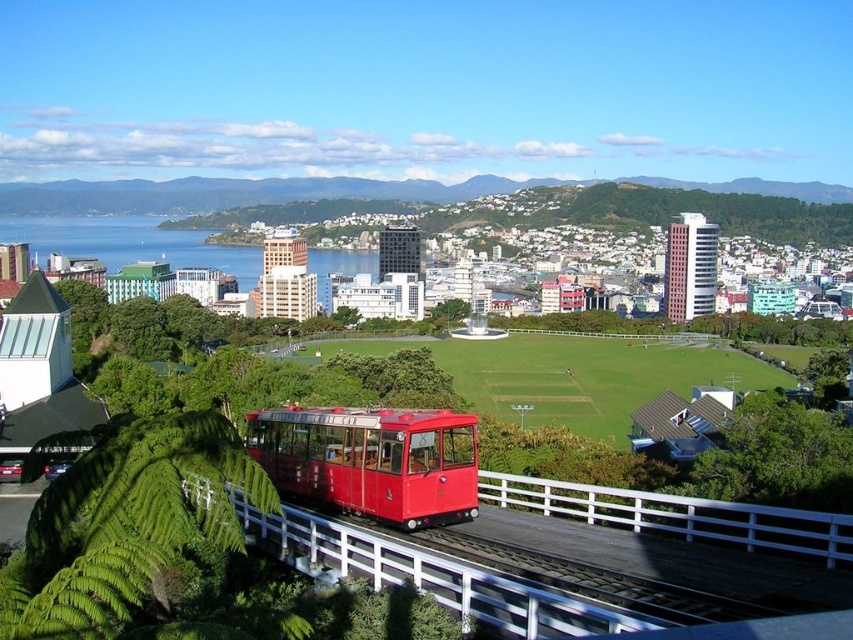
Which of these two, matte red tram at center or blue water at center, stands shorter?

With less height is matte red tram at center.

You are a GUI agent. You are given a task and a screenshot of the screen. Output one action in this format:
    pyautogui.click(x=<x>, y=<y>)
    Task: Click on the matte red tram at center
    Image resolution: width=853 pixels, height=640 pixels.
    Given the screenshot: What is the action you would take?
    pyautogui.click(x=370, y=460)